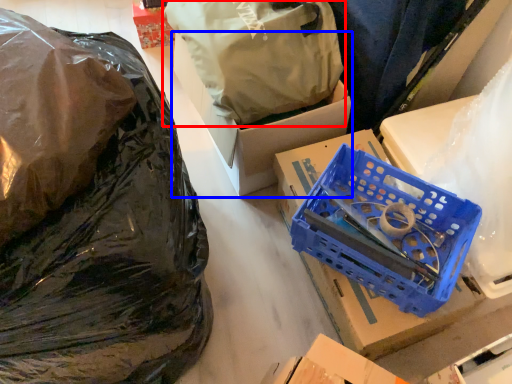
Question: Which object appears closest to the camera in this image, plastic bag (highlighted by a red box) or box (highlighted by a blue box)?

Choices:
 (A) plastic bag
 (B) box

Answer: (A)